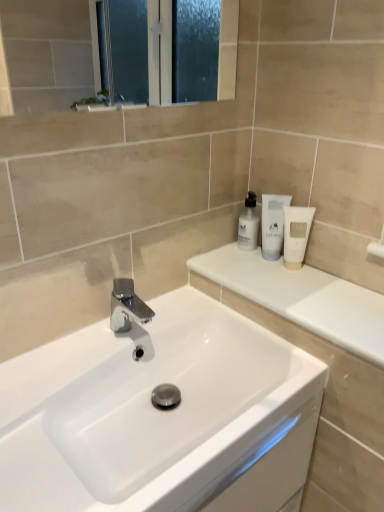
Image resolution: width=384 pixels, height=512 pixels. Identify the location of free location in front of polished chrome tap at center. (79, 373).